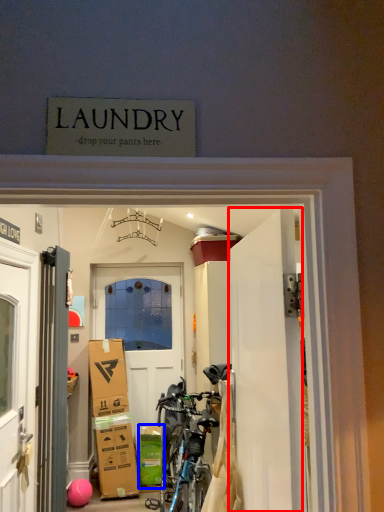
Question: Which of the following is the farthest to the observer, door (highlighted by a red box) or cardboard box (highlighted by a blue box)?

Choices:
 (A) door
 (B) cardboard box

Answer: (B)